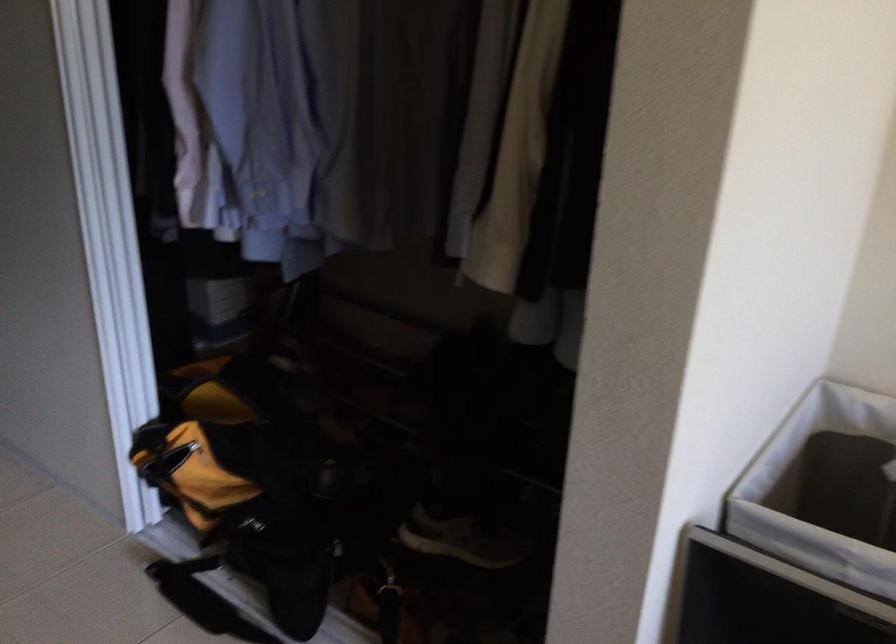
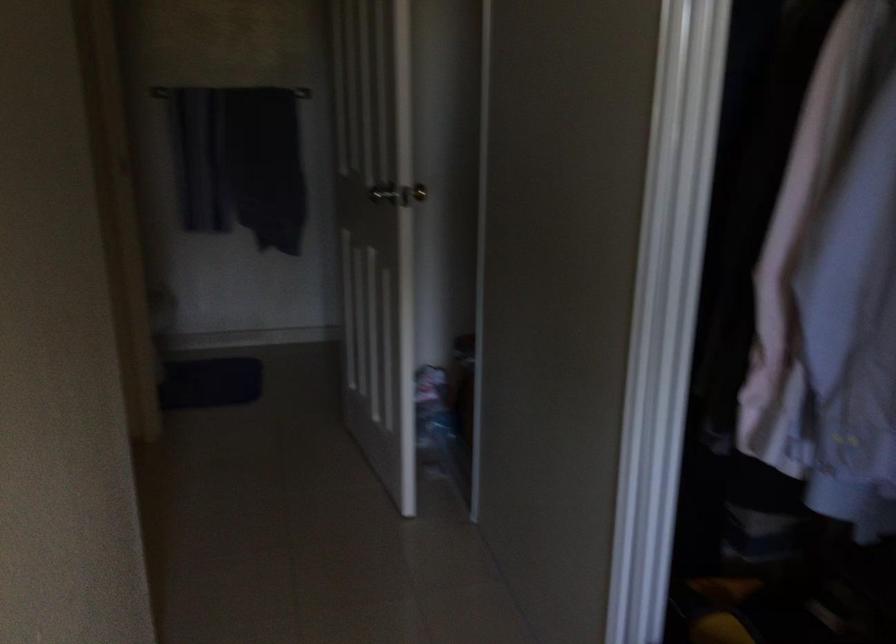
Question: Based on the continuous images, in which direction is the camera rotating? Reply with the corresponding letter.

Choices:
 (A) Left
 (B) Right
 (C) Up
 (D) Down

Answer: (A)